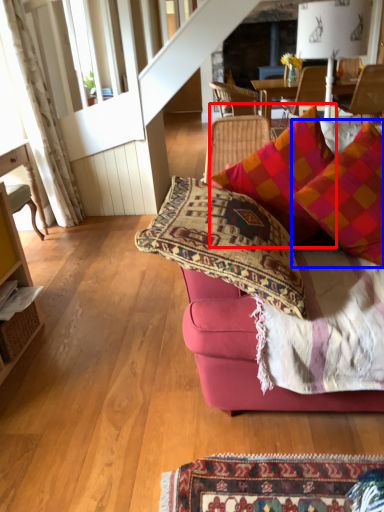
Question: Among these objects, which one is nearest to the camera, pillow (highlighted by a red box) or pillow (highlighted by a blue box)?

Choices:
 (A) pillow
 (B) pillow

Answer: (B)